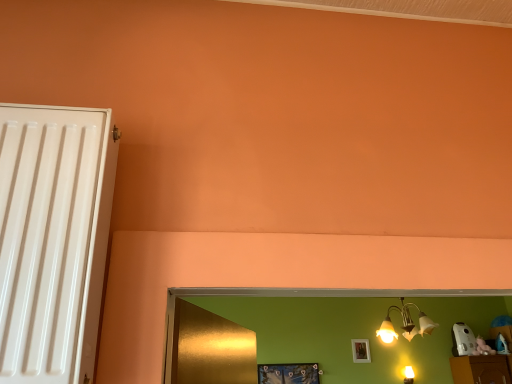
Question: Considering the relative sizes of metallic blue picture frame at lower center, acting as the 2th picture frame starting from the right, and white matte picture frame at upper center, which is the first picture frame in back-to-front order, in the image provided, is metallic blue picture frame at lower center, acting as the 2th picture frame starting from the right, wider than white matte picture frame at upper center, which is the first picture frame in back-to-front order,?

Choices:
 (A) yes
 (B) no

Answer: (A)

Question: Does metallic blue picture frame at lower center, which is the second picture frame in back-to-front order, have a greater height compared to white matte picture frame at upper center, which appears as the 1th picture frame when viewed from the right?

Choices:
 (A) no
 (B) yes

Answer: (A)

Question: From a real-world perspective, is metallic blue picture frame at lower center, the first picture frame when ordered from left to right, positioned under white matte picture frame at upper center, which is the first picture frame in back-to-front order, based on gravity?

Choices:
 (A) no
 (B) yes

Answer: (B)

Question: Is metallic blue picture frame at lower center, the first picture frame when ordered from left to right, outside white matte picture frame at upper center, which is the first picture frame in back-to-front order?

Choices:
 (A) yes
 (B) no

Answer: (A)

Question: From a real-world perspective, is metallic blue picture frame at lower center, which is the second picture frame in back-to-front order, over white matte picture frame at upper center, arranged as the 2th picture frame when viewed from the front?

Choices:
 (A) yes
 (B) no

Answer: (B)

Question: In terms of height, does metallic blue picture frame at lower center, the 1th picture frame in the front-to-back sequence, look taller or shorter compared to white matte picture frame at upper center, which is the first picture frame in back-to-front order?

Choices:
 (A) short
 (B) tall

Answer: (A)

Question: Based on their positions, is metallic blue picture frame at lower center, the first picture frame when ordered from left to right, located to the left or right of white matte picture frame at upper center, which appears as the 1th picture frame when viewed from the right?

Choices:
 (A) right
 (B) left

Answer: (B)

Question: Considering the positions of metallic blue picture frame at lower center, acting as the 2th picture frame starting from the right, and white matte picture frame at upper center, which is the first picture frame in back-to-front order, in the image, is metallic blue picture frame at lower center, acting as the 2th picture frame starting from the right, wider or thinner than white matte picture frame at upper center, which is the first picture frame in back-to-front order,?

Choices:
 (A) wide
 (B) thin

Answer: (A)

Question: Looking at the image, does metallic blue picture frame at lower center, which is the second picture frame in back-to-front order, seem bigger or smaller compared to white matte picture frame at upper center, acting as the 2th picture frame starting from the left?

Choices:
 (A) big
 (B) small

Answer: (A)

Question: Considering the positions of white matte picture frame at upper center, which is the first picture frame in back-to-front order, and metallic blue picture frame at lower center, the first picture frame when ordered from left to right, in the image, is white matte picture frame at upper center, which is the first picture frame in back-to-front order, wider or thinner than metallic blue picture frame at lower center, the first picture frame when ordered from left to right,?

Choices:
 (A) wide
 (B) thin

Answer: (B)

Question: From their relative heights in the image, would you say white matte picture frame at upper center, arranged as the 2th picture frame when viewed from the front, is taller or shorter than metallic blue picture frame at lower center, the 1th picture frame in the front-to-back sequence?

Choices:
 (A) tall
 (B) short

Answer: (A)

Question: Relative to metallic blue picture frame at lower center, the first picture frame when ordered from left to right, is white matte picture frame at upper center, acting as the 2th picture frame starting from the left, in front or behind?

Choices:
 (A) front
 (B) behind

Answer: (B)

Question: Would you say white matte picture frame at upper center, acting as the 2th picture frame starting from the left, is to the left or to the right of metallic blue picture frame at lower center, the 1th picture frame in the front-to-back sequence, in the picture?

Choices:
 (A) right
 (B) left

Answer: (A)

Question: From a real-world perspective, relative to metallic gold chandelier at upper right, is white matte picture frame at upper center, acting as the 2th picture frame starting from the left, vertically above or below?

Choices:
 (A) above
 (B) below

Answer: (B)

Question: Looking at the image, does white matte picture frame at upper center, which appears as the 1th picture frame when viewed from the right, seem bigger or smaller compared to metallic gold chandelier at upper right?

Choices:
 (A) big
 (B) small

Answer: (B)